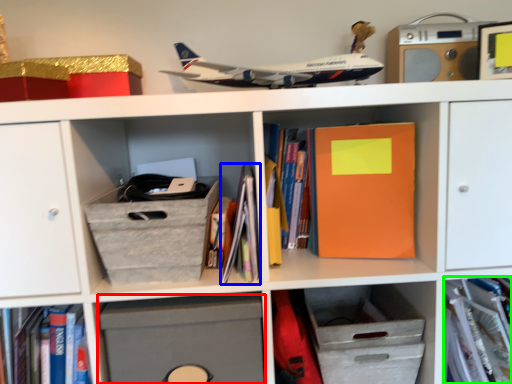
Question: Which object is positioned closest to cabinet (highlighted by a red box)? Select from book (highlighted by a blue box) and book (highlighted by a green box).

Choices:
 (A) book
 (B) book

Answer: (A)